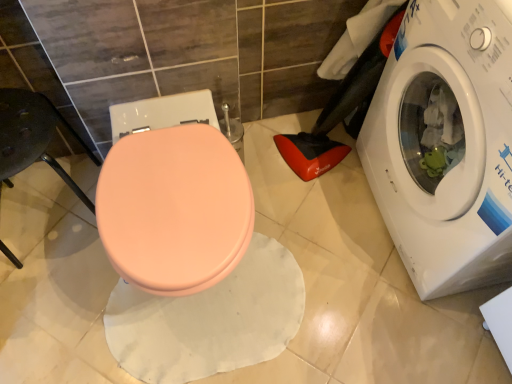
Identify the location of free space above matte pink bidet at center (from a real-world perspective). (169, 198).